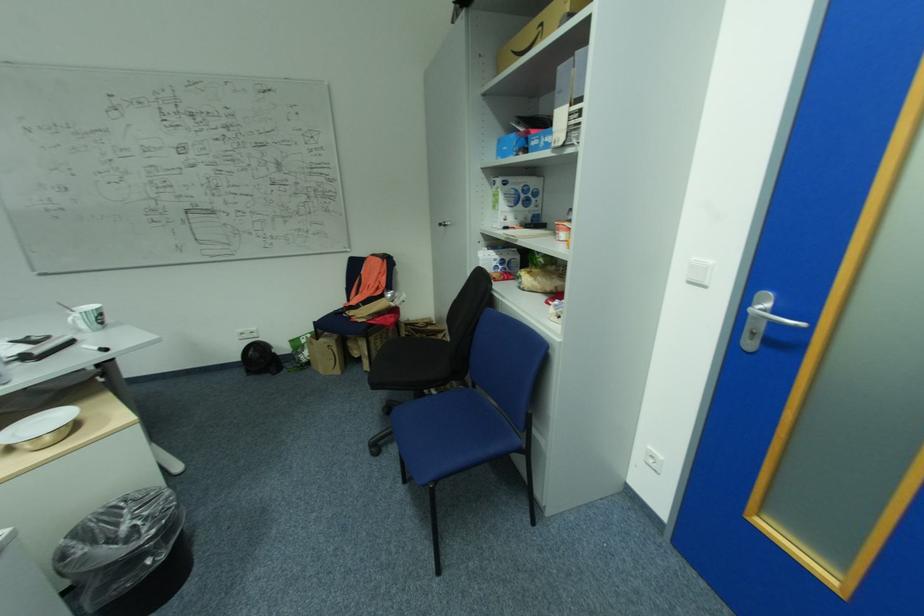
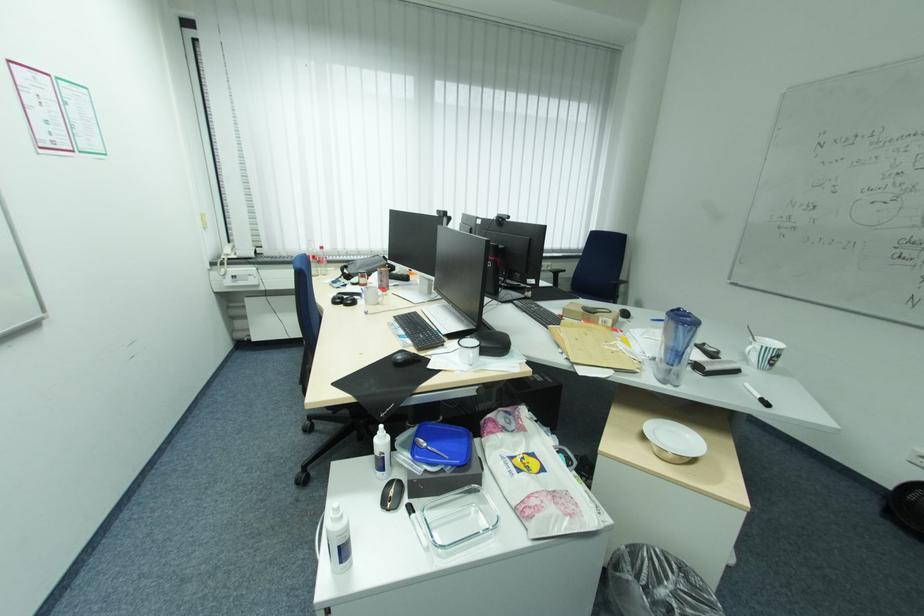
Question: I am providing you with two images of the same scene from different viewpoints. Which of the following objects are not visible in image2?

Choices:
 (A) whiteboard eraser
 (B) black computer mouse
 (C) black keyboard
 (D) none of these

Answer: (D)